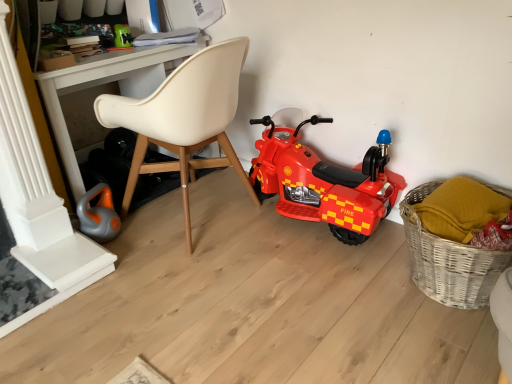
Where is `vacant space in between orange rubber toy at lower left, positioned as the second toy in top-to-bottom order, and woven wicker basket at lower right`? The width and height of the screenshot is (512, 384). vacant space in between orange rubber toy at lower left, positioned as the second toy in top-to-bottom order, and woven wicker basket at lower right is located at coordinates (264, 256).